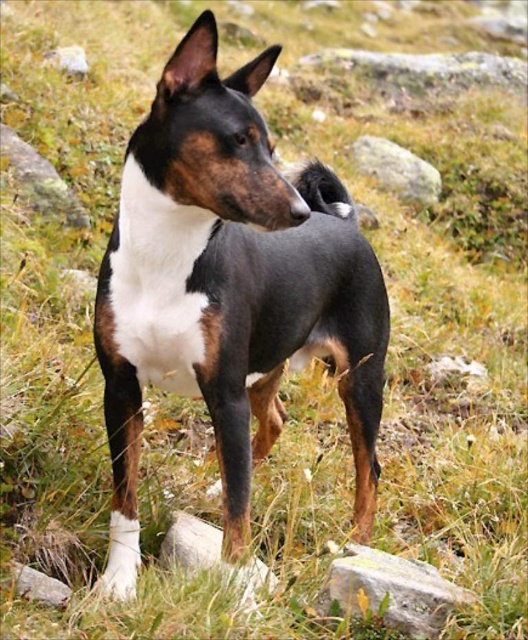
Between gray rock at upper center and gray rock at lower left, which one has less height?

Standing shorter between the two is gray rock at lower left.

Locate an element on the screen. gray rock at upper center is located at coordinates pyautogui.click(x=397, y=170).

Between point (371, 156) and point (29, 593), which one is positioned behind?

The point (371, 156) is more distant.

At what (x,y) coordinates should I click in order to perform the action: click on gray rock at upper center. Please return your answer as a coordinate pair (x, y). Looking at the image, I should click on (397, 170).

Is white smooth rock at lower center above gray rock at upper center?

No.

Is white smooth rock at lower center shorter than gray rock at upper center?

Yes.

Where is `white smooth rock at lower center`? white smooth rock at lower center is located at coordinates (209, 554).

Identify the location of gray rough rock at lower center. (389, 592).

Does point (353, 598) come behind point (204, 566)?

No, it is not.

Who is more distant from viewer, (344, 563) or (251, 582)?

The point (344, 563) is more distant.

Identify the location of gray rough rock at lower center. This screenshot has height=640, width=528. (389, 592).